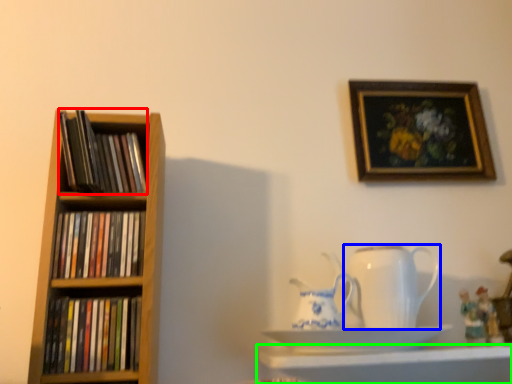
Question: Which object is positioned closest to book (highlighted by a red box)? Select from jug (highlighted by a blue box) and shelf (highlighted by a green box).

Choices:
 (A) jug
 (B) shelf

Answer: (A)